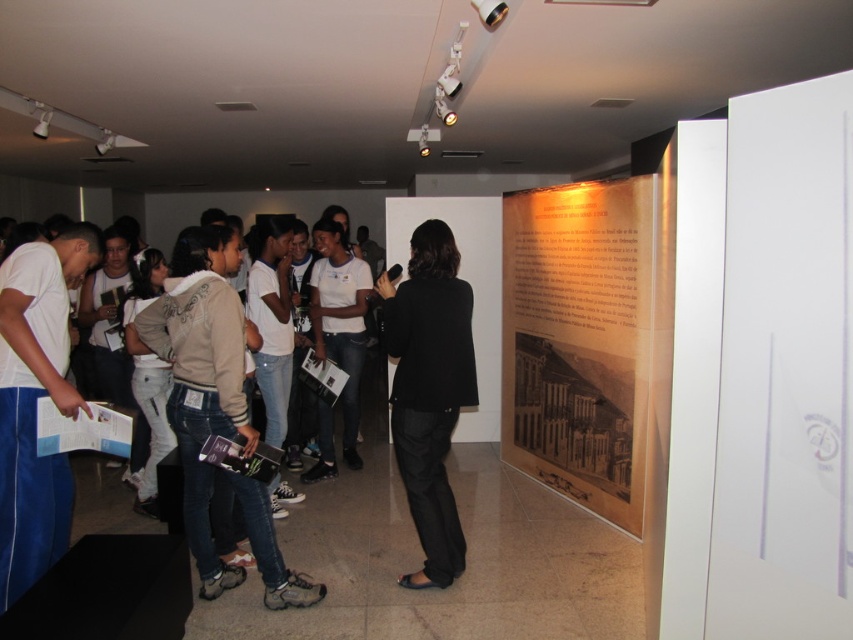
Who is lower down, brown paper poster at center or black matte blazer at center?

Positioned lower is black matte blazer at center.

At what (x,y) coordinates should I click in order to perform the action: click on brown paper poster at center. Please return your answer as a coordinate pair (x, y). The height and width of the screenshot is (640, 853). Looking at the image, I should click on (579, 339).